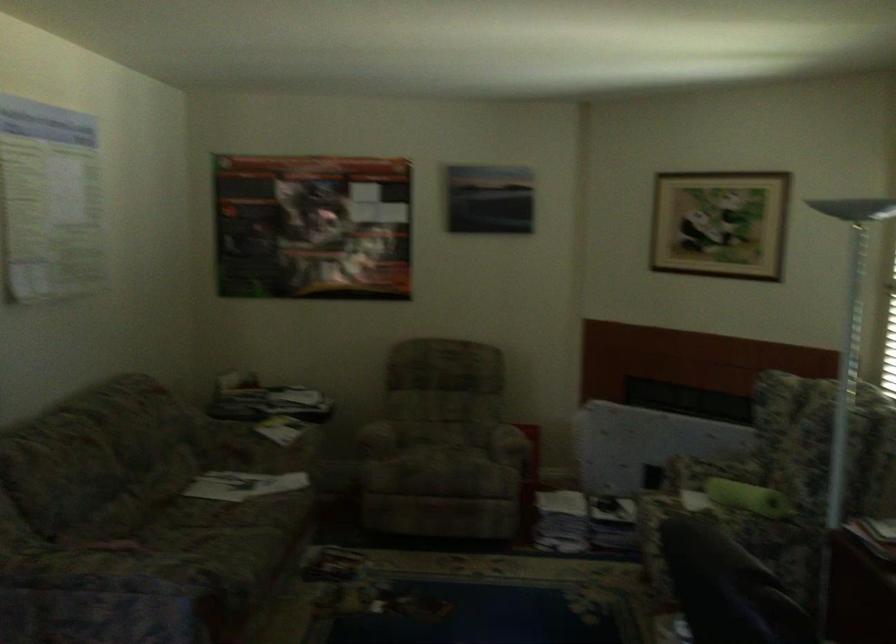
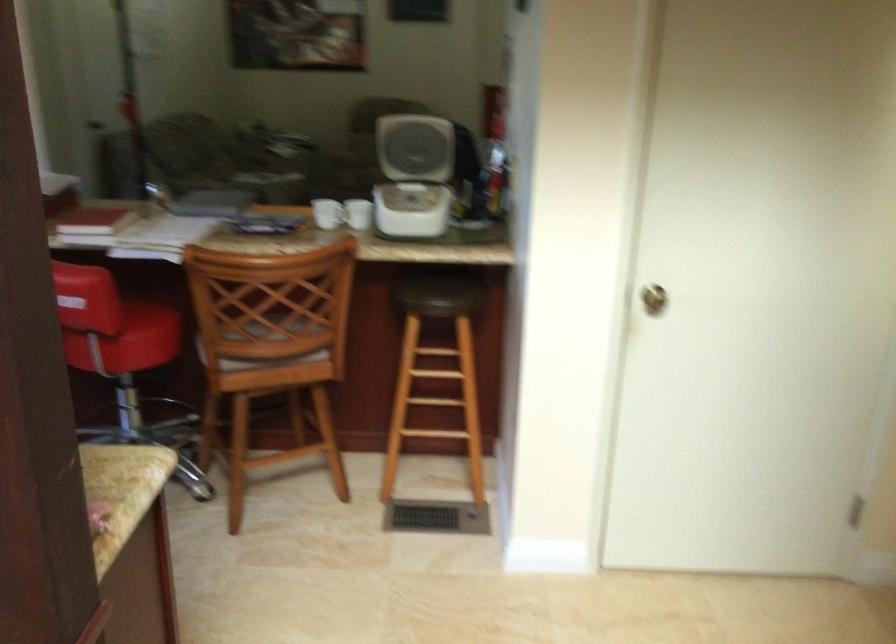
Question: I am providing you with two images of the same scene from different viewpoints. Which of the following objects are not visible in image2?

Choices:
 (A) stool sitting surface
 (B) chair armrest
 (C) red blocky toy
 (D) white appliance lid

Answer: (B)